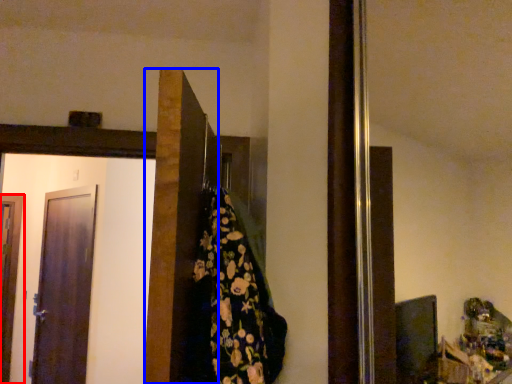
Question: Among these objects, which one is farthest to the camera, door (highlighted by a red box) or door (highlighted by a blue box)?

Choices:
 (A) door
 (B) door

Answer: (A)